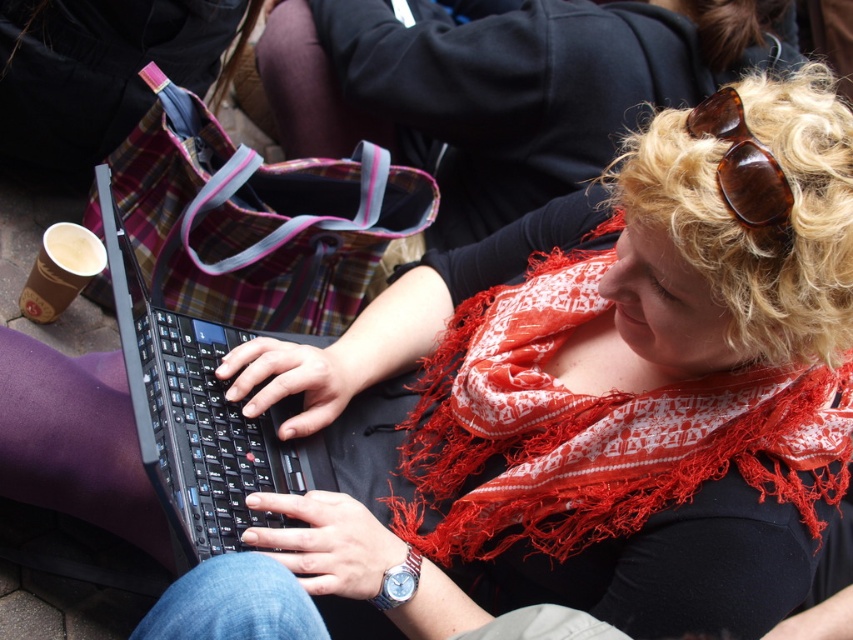
You are trying to decide whether to place a new accessory on the table next to the red fringed scarf at center and the black plastic laptop at center. Which object requires more horizontal space?

The red fringed scarf at center might be wider than black plastic laptop at center, so it might require more horizontal space.

You are a photographer trying to capture a closeup of the person while ensuring the red fringed scarf at center remains in focus. Given that your camera has a depth of field that can sharply focus on objects within 30 inches, will the scarf be in focus?

The red fringed scarf at center is 31.37 inches from the viewer, which is slightly beyond the camera lens depth of field of 30 inches. Therefore, the scarf will be slightly out of focus in the photograph.